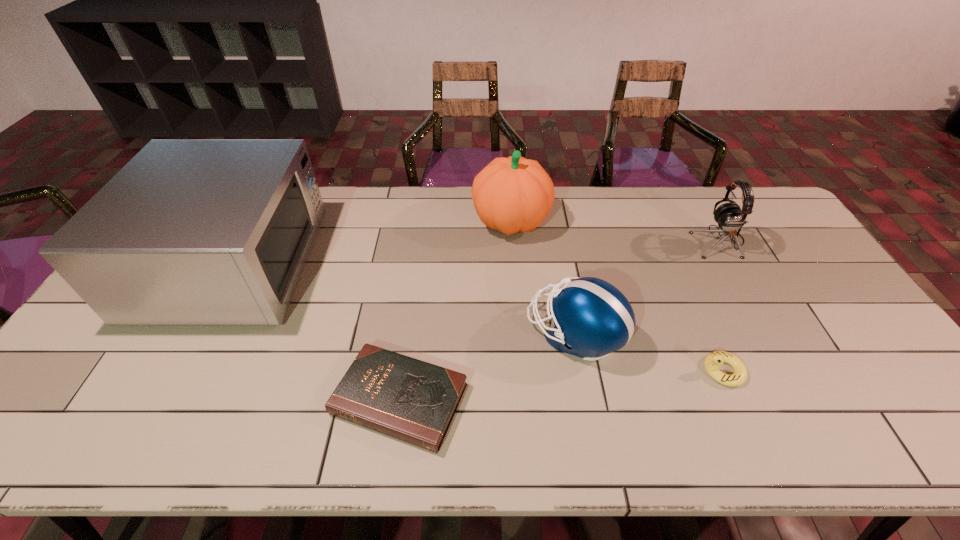
Find the location of `free spot that satisfies the following two spatial constraints: 1. on the face of the second shortest object; 2. on the front side of the shortest object`. free spot that satisfies the following two spatial constraints: 1. on the face of the second shortest object; 2. on the front side of the shortest object is located at coordinates (734, 399).